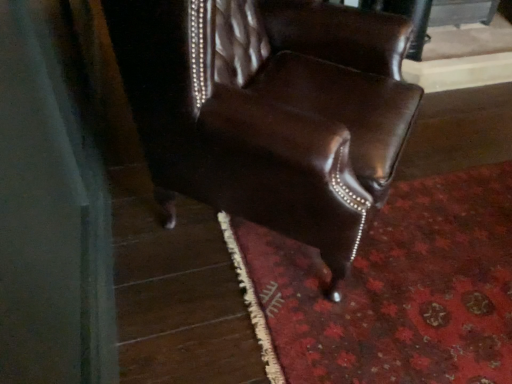
The height and width of the screenshot is (384, 512). What are the coordinates of `floral carpet at lower right` in the screenshot? It's located at (392, 289).

What do you see at coordinates (392, 289) in the screenshot? This screenshot has width=512, height=384. I see `floral carpet at lower right` at bounding box center [392, 289].

This screenshot has width=512, height=384. What do you see at coordinates (268, 111) in the screenshot?
I see `shiny brown leather chair at center` at bounding box center [268, 111].

Find the location of a particular element. This screenshot has height=384, width=512. shiny brown leather chair at center is located at coordinates (268, 111).

Find the location of a particular element. Image resolution: width=512 pixels, height=384 pixels. floral carpet at lower right is located at coordinates (392, 289).

In the scene shown: In the image, is shiny brown leather chair at center on the left side or the right side of floral carpet at lower right?

shiny brown leather chair at center is positioned on floral carpet at lower right's left side.

Which object is closer to the camera, shiny brown leather chair at center or floral carpet at lower right?

shiny brown leather chair at center.

Does point (368, 33) come in front of point (477, 256)?

Yes, point (368, 33) is in front of point (477, 256).

From the image's perspective, which is below, shiny brown leather chair at center or floral carpet at lower right?

floral carpet at lower right.

From a real-world perspective, is shiny brown leather chair at center located higher than floral carpet at lower right?

Yes.

Considering the sizes of shiny brown leather chair at center and floral carpet at lower right in the image, is shiny brown leather chair at center wider or thinner than floral carpet at lower right?

shiny brown leather chair at center is thinner than floral carpet at lower right.

Considering the sizes of objects shiny brown leather chair at center and floral carpet at lower right in the image provided, who is taller, shiny brown leather chair at center or floral carpet at lower right?

shiny brown leather chair at center is taller.

Considering the sizes of shiny brown leather chair at center and floral carpet at lower right in the image, is shiny brown leather chair at center bigger or smaller than floral carpet at lower right?

Considering their sizes, shiny brown leather chair at center takes up more space than floral carpet at lower right.

Is shiny brown leather chair at center inside or outside of floral carpet at lower right?

shiny brown leather chair at center is not enclosed by floral carpet at lower right.

Is there a large distance between shiny brown leather chair at center and floral carpet at lower right?

No, there isn't a large distance between shiny brown leather chair at center and floral carpet at lower right.

Is floral carpet at lower right at the back of shiny brown leather chair at center?

No, shiny brown leather chair at center is not facing the opposite direction of floral carpet at lower right.

What's the angular difference between shiny brown leather chair at center and floral carpet at lower right's facing directions?

shiny brown leather chair at center and floral carpet at lower right are facing 132 degrees away from each other.

How distant is shiny brown leather chair at center from floral carpet at lower right?

shiny brown leather chair at center and floral carpet at lower right are 16.95 inches apart.

The width and height of the screenshot is (512, 384). I want to click on mat that appears behind the shiny brown leather chair at center, so click(x=392, y=289).

Does floral carpet at lower right appear on the left side of shiny brown leather chair at center?

No.

Which object is more forward, floral carpet at lower right or shiny brown leather chair at center?

shiny brown leather chair at center is closer to the camera.

Does point (481, 199) appear closer or farther from the camera than point (117, 40)?

Point (481, 199) is farther from the camera than point (117, 40).

From the image's perspective, which is below, floral carpet at lower right or shiny brown leather chair at center?

floral carpet at lower right appears lower in the image.

From a real-world perspective, does floral carpet at lower right sit lower than shiny brown leather chair at center?

Yes, from a real-world perspective, floral carpet at lower right is under shiny brown leather chair at center.

Which of these two, floral carpet at lower right or shiny brown leather chair at center, is wider?

Wider between the two is floral carpet at lower right.

Between floral carpet at lower right and shiny brown leather chair at center, which one has less height?

With less height is floral carpet at lower right.

Does floral carpet at lower right have a smaller size compared to shiny brown leather chair at center?

Indeed, floral carpet at lower right has a smaller size compared to shiny brown leather chair at center.

Would you say shiny brown leather chair at center is part of floral carpet at lower right's contents?

Actually, shiny brown leather chair at center is outside floral carpet at lower right.

Are floral carpet at lower right and shiny brown leather chair at center beside each other?

No, floral carpet at lower right is not touching shiny brown leather chair at center.

Is floral carpet at lower right aimed at shiny brown leather chair at center?

No, floral carpet at lower right is not oriented towards shiny brown leather chair at center.

Can you tell me how much floral carpet at lower right and shiny brown leather chair at center differ in facing direction?

132 degrees.

How distant is floral carpet at lower right from shiny brown leather chair at center?

The distance of floral carpet at lower right from shiny brown leather chair at center is 16.95 inches.

The image size is (512, 384). In order to click on mat lying behind the shiny brown leather chair at center in this screenshot , I will do `click(392, 289)`.

Identify the location of mat behind the shiny brown leather chair at center. This screenshot has height=384, width=512. pos(392,289).

The height and width of the screenshot is (384, 512). Identify the location of chair that appears above the floral carpet at lower right (from a real-world perspective). (268, 111).